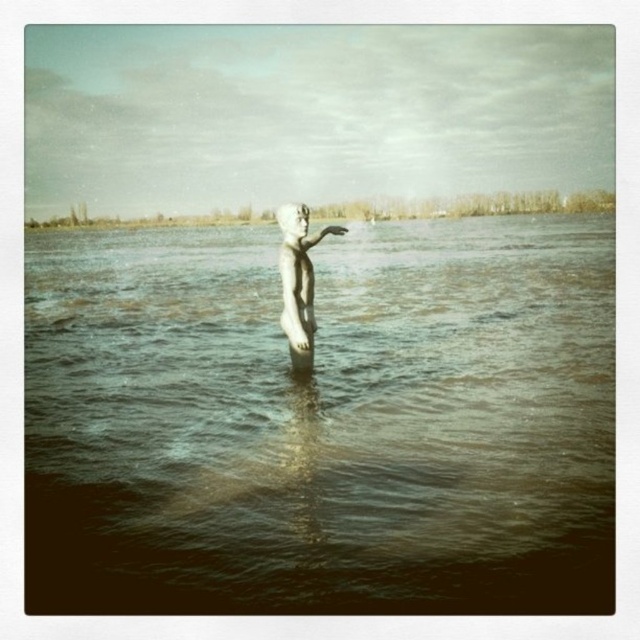
Question: Is metallic water at center in front of white stone statue at center?

Choices:
 (A) yes
 (B) no

Answer: (A)

Question: Is metallic water at center behind white stone statue at center?

Choices:
 (A) yes
 (B) no

Answer: (B)

Question: Which of the following is the farthest from the observer?

Choices:
 (A) (305, 285)
 (B) (332, 246)

Answer: (B)

Question: Considering the relative positions of metallic water at center and white stone statue at center in the image provided, where is metallic water at center located with respect to white stone statue at center?

Choices:
 (A) below
 (B) above

Answer: (B)